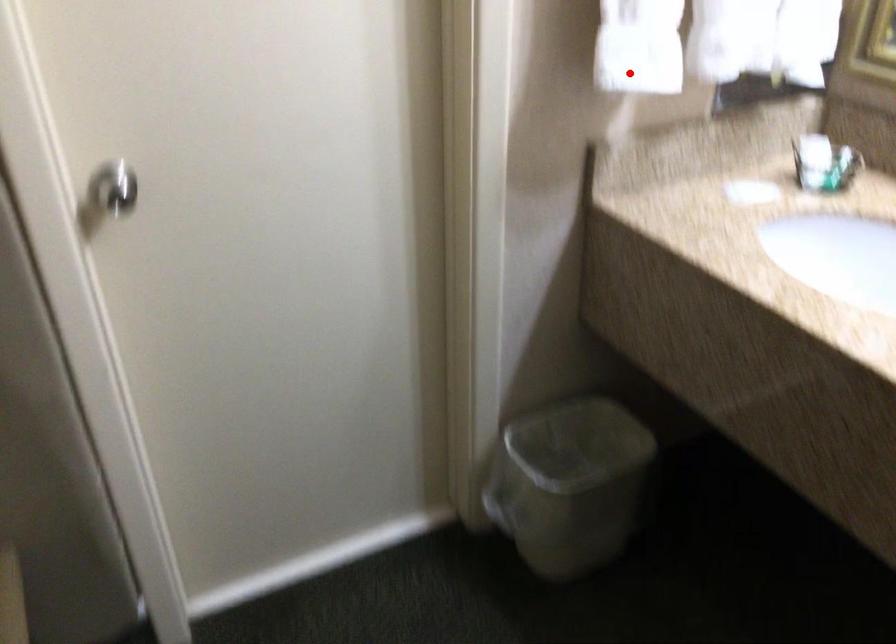
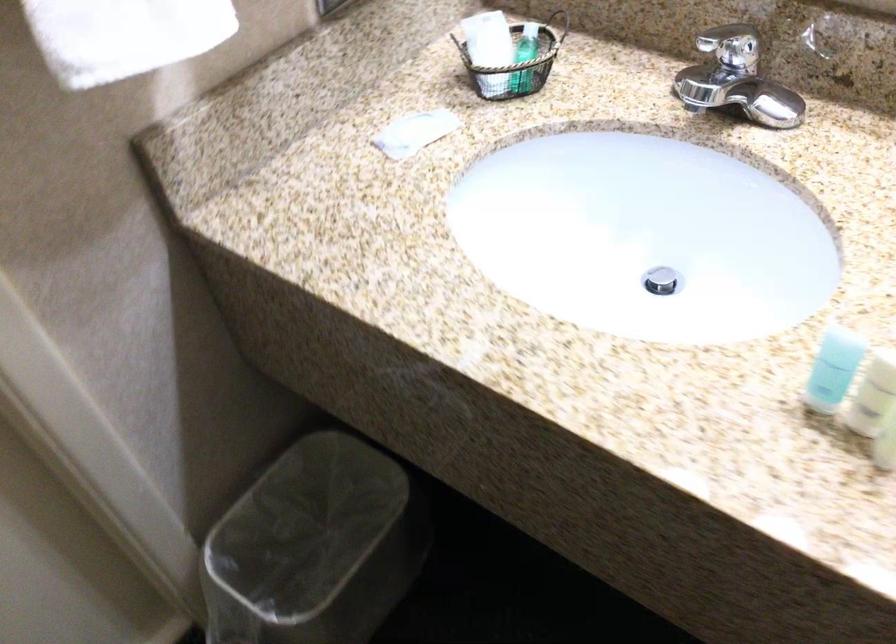
In the second image, find the point that corresponds to the highlighted location in the first image.

(124, 35)